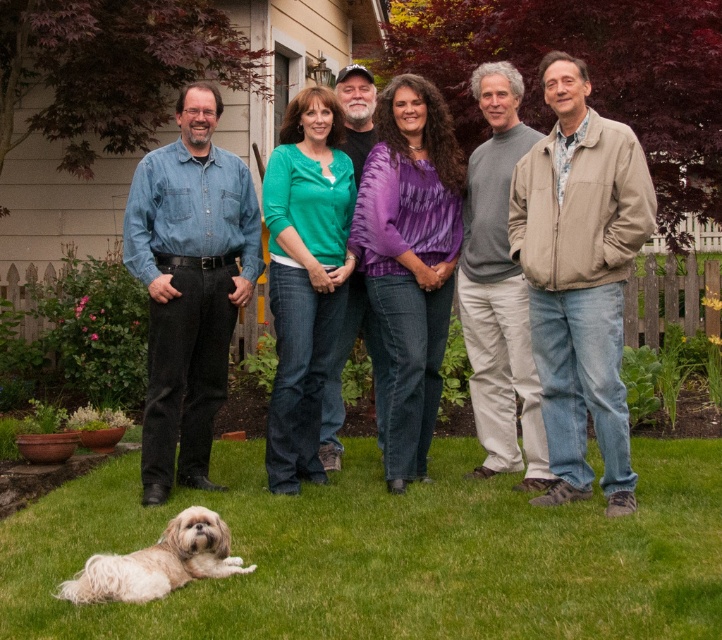
You are a photographer trying to capture a closeup of the tan suede jacket at right and the green denim jeans at center. Which object should you focus on first to ensure it appears sharp in the photo?

The tan suede jacket at right is closer to the viewer than the green denim jeans at center, so you should focus on the tan suede jacket at right first to ensure it appears sharp.

You are organizing a clothing donation drive and need to determine which item takes up more space in the donation box. Based on the image, which item is bigger in size between the tan suede jacket at right and the green denim jeans at center?

The tan suede jacket at right is larger in size than the green denim jeans at center, so it takes up more space in the donation box.